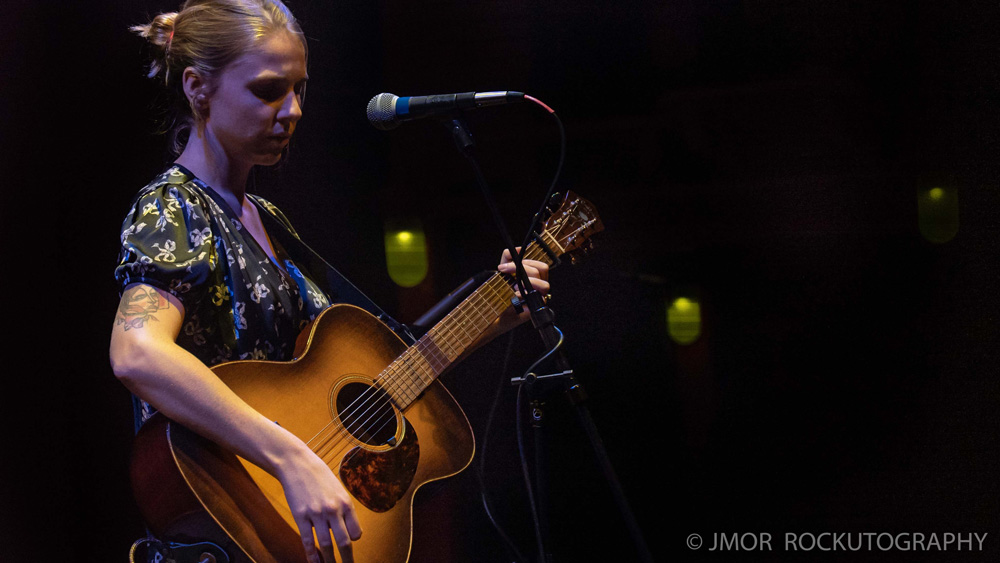
The height and width of the screenshot is (563, 1000). What are the coordinates of `latch` in the screenshot? It's located at (571, 386).